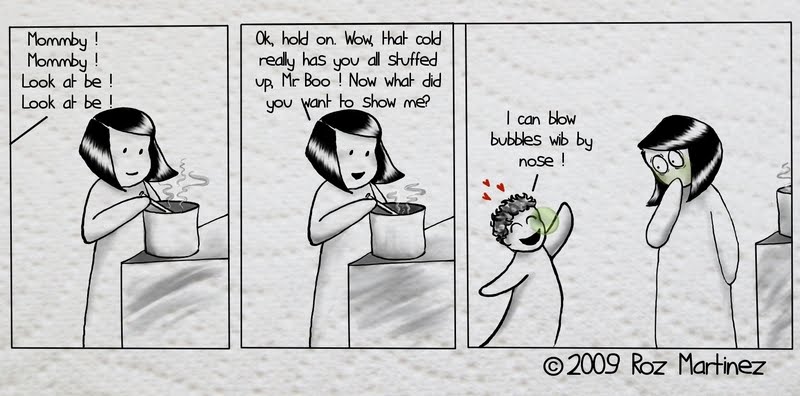
Locate an element on the screen. This screenshot has height=396, width=800. stirring spoon handle is located at coordinates (157, 204), (382, 206).